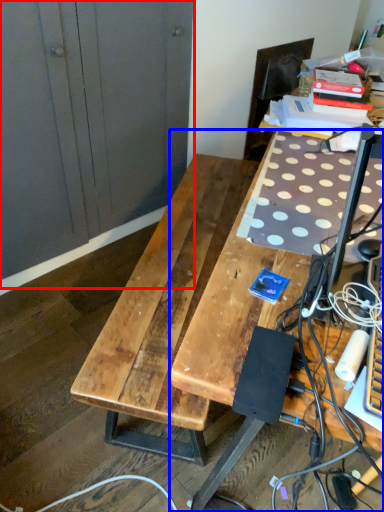
Question: Which object is further to the camera taking this photo, dresser (highlighted by a red box) or desk (highlighted by a blue box)?

Choices:
 (A) dresser
 (B) desk

Answer: (A)